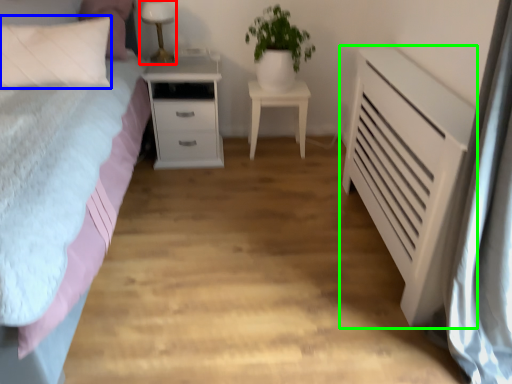
Question: Which object is the farthest from table lamp (highlighted by a red box)? Choose among these: pillow (highlighted by a blue box) or chest of drawers (highlighted by a green box).

Choices:
 (A) pillow
 (B) chest of drawers

Answer: (B)